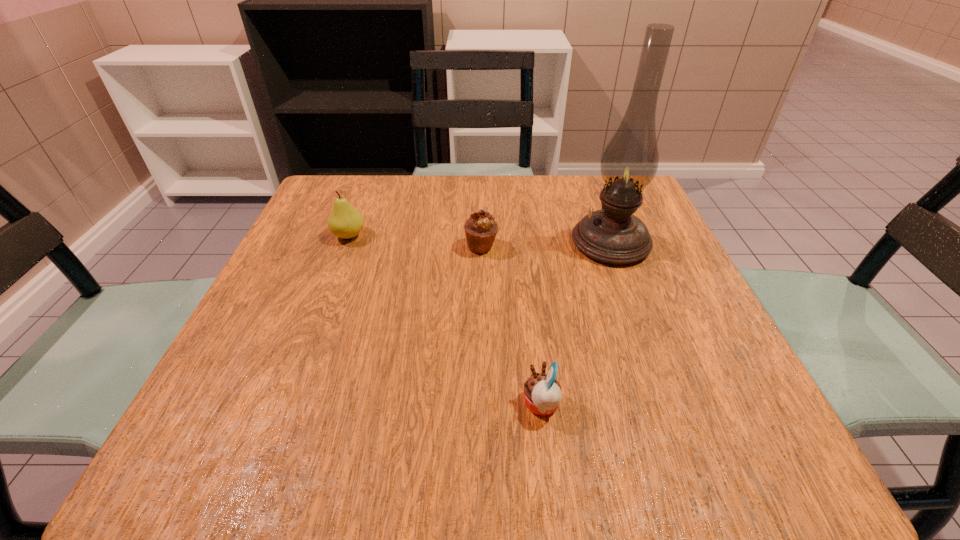
You are a GUI agent. You are given a task and a screenshot of the screen. Output one action in this format:
    pyautogui.click(x=<x>, y=<y>)
    Task: Click on the vacant space at the far edge of the desktop
    
    Given the screenshot: What is the action you would take?
    pyautogui.click(x=540, y=200)

Find the location of `blank space at the near edge`. blank space at the near edge is located at coordinates (348, 456).

Identify the location of vacant area at the left edge. (349, 261).

This screenshot has width=960, height=540. What are the coordinates of `vacant space at the right edge of the desktop` in the screenshot? It's located at (732, 379).

I want to click on vacant space at the far left corner of the desktop, so click(x=362, y=179).

What are the coordinates of `vacant space at the far right corner` in the screenshot? It's located at (593, 190).

At what (x,y) coordinates should I click in order to perform the action: click on vacant space at the near right corner of the desktop. Please return your answer as a coordinate pair (x, y). Looking at the image, I should click on (700, 468).

At what (x,y) coordinates should I click in order to perform the action: click on free area in between the second object from right to left and the tallest object. Please return your answer as a coordinate pair (x, y). Looking at the image, I should click on (576, 323).

Locate an element on the screen. Image resolution: width=960 pixels, height=540 pixels. unoccupied position between the nearer muffin and the left muffin is located at coordinates (512, 326).

Identify the location of free point between the second object from left to right and the nearest object. This screenshot has width=960, height=540. (512, 326).